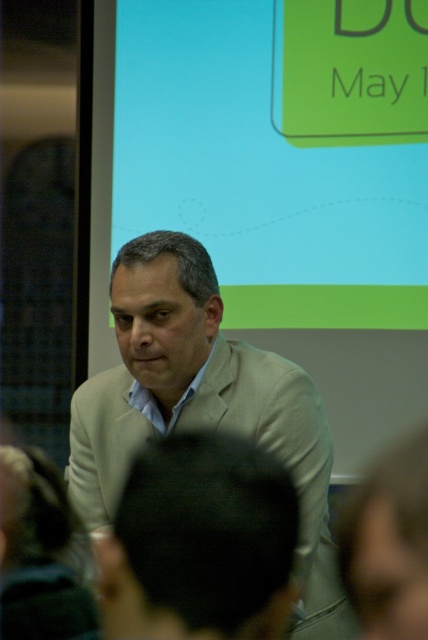
You are an event planner trying to set up a presentation. You have a matte green projection screen at upper center and a beige fabric suit at center in the room. Which object would require more space to accommodate its size?

The matte green projection screen at upper center has a larger size compared to the beige fabric suit at center, so it would require more space to accommodate its size.

You are an interior designer observing a man in a conference room. You notice two beige items on him. The beige sweater at center and the beige fabric suit at center. Which one is positioned to the left?

The beige sweater at center is to the left of the beige fabric suit at center.

You are an attendee in the conference room and want to see the full text on the projection screen. The presenter is blocking part of it. Considering the size of the matte green projection screen at upper center and the beige sweater at center, which object is larger and might be easier to see around?

The matte green projection screen at upper center is larger than the beige sweater at center, so it might be easier to see around the presenter by moving to a side where the screen is not blocked.